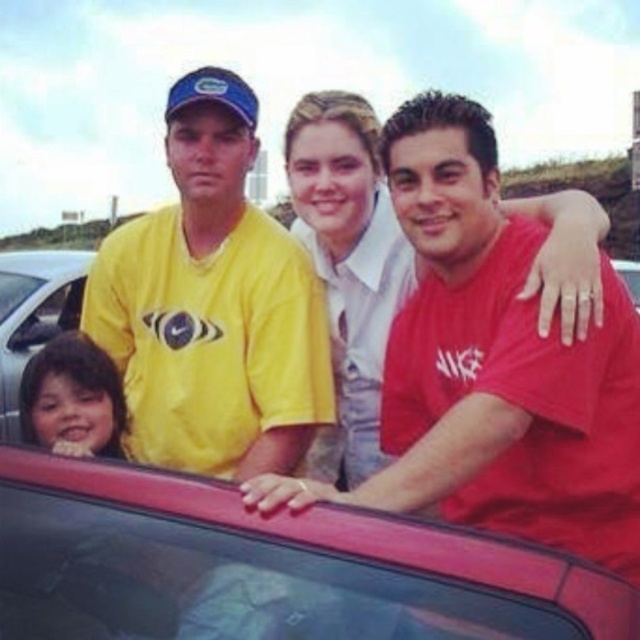
Question: Where is yellow matte t-shirt at center located in relation to metallic silver car at lower left in the image?

Choices:
 (A) below
 (B) above

Answer: (B)

Question: Considering the real-world distances, which object is closest to the transparent glass car window at center?

Choices:
 (A) yellow matte t-shirt at center
 (B) metallic silver car at lower left

Answer: (A)

Question: Which object is closer to the camera taking this photo?

Choices:
 (A) transparent glass car window at center
 (B) metallic silver car at lower left

Answer: (A)

Question: Which of the following is the closest to the observer?

Choices:
 (A) yellow matte t-shirt at center
 (B) metallic silver car at lower left

Answer: (A)

Question: Does transparent glass car window at center have a greater width compared to metallic silver car at lower left?

Choices:
 (A) yes
 (B) no

Answer: (A)

Question: Is transparent glass car window at center to the left of metallic silver car at lower left from the viewer's perspective?

Choices:
 (A) no
 (B) yes

Answer: (A)